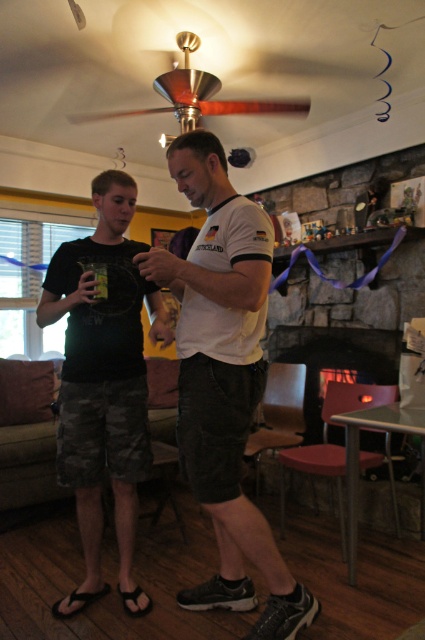
Question: Which object appears farthest from the camera in this image?

Choices:
 (A) camouflage shorts at center
 (B) white cotton t-shirt at center

Answer: (A)

Question: Which object is positioned closest to the white cotton t-shirt at center?

Choices:
 (A) wooden ceiling fan at upper center
 (B) dark stone fireplace at center

Answer: (A)

Question: Does dark stone fireplace at center lie behind wooden ceiling fan at upper center?

Choices:
 (A) no
 (B) yes

Answer: (B)

Question: Which is nearer to the white cotton t-shirt at center?

Choices:
 (A) wooden ceiling fan at upper center
 (B) dark stone fireplace at center
 (C) camouflage shorts at center

Answer: (C)

Question: Is dark stone fireplace at center further to camera compared to wooden ceiling fan at upper center?

Choices:
 (A) yes
 (B) no

Answer: (A)

Question: Does white cotton t-shirt at center have a lesser width compared to camouflage shorts at center?

Choices:
 (A) no
 (B) yes

Answer: (A)